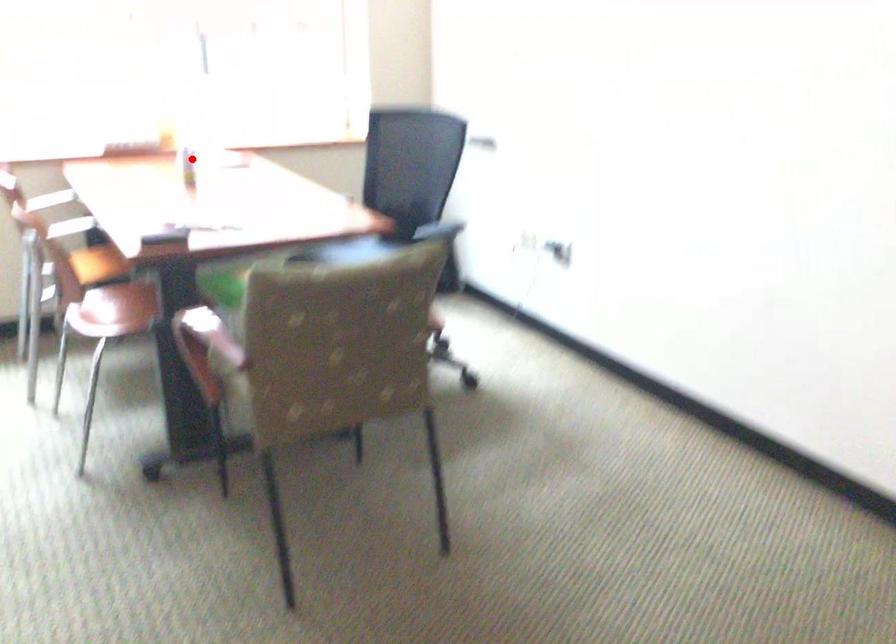
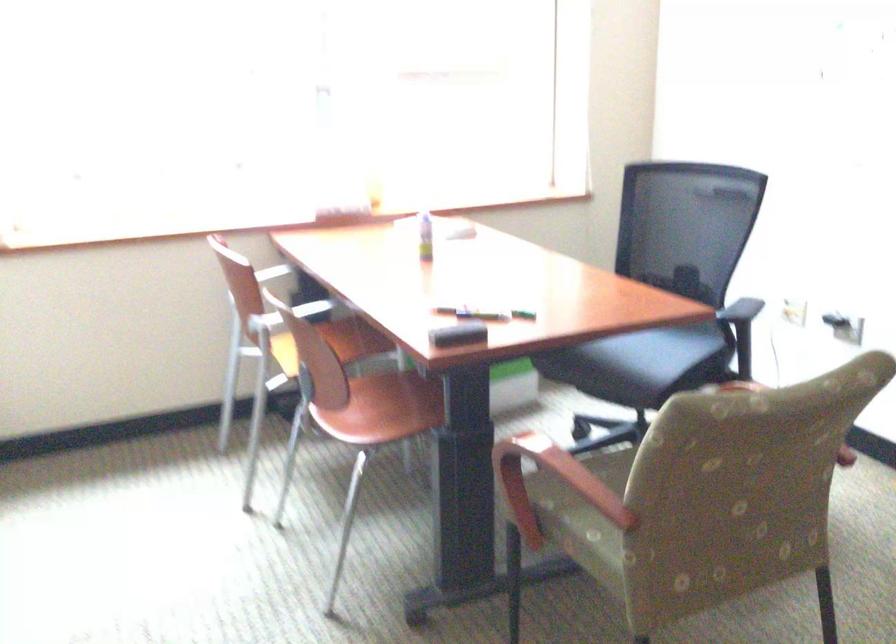
Where in the second image is the point corresponding to the highlighted location from the first image?

(425, 236)